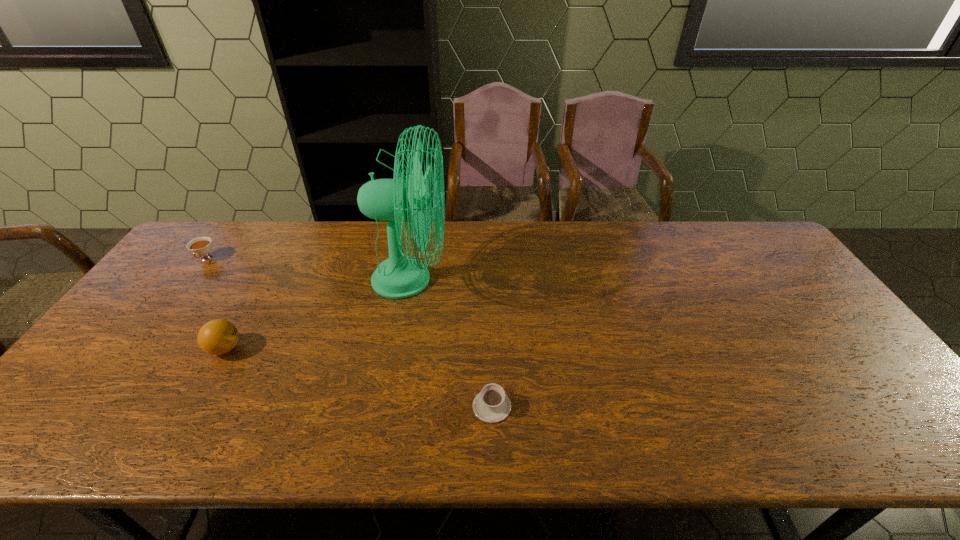
You are a GUI agent. You are given a task and a screenshot of the screen. Output one action in this format:
    pyautogui.click(x=<x>, y=<y>)
    Task: Click on the empty location between the tallest object and the ping-pong ball
    The width and height of the screenshot is (960, 540).
    Given the screenshot: What is the action you would take?
    click(x=318, y=314)

This screenshot has width=960, height=540. Find the location of `vacant region between the taller teacup and the nearest object`. vacant region between the taller teacup and the nearest object is located at coordinates (348, 333).

You are a GUI agent. You are given a task and a screenshot of the screen. Output one action in this format:
    pyautogui.click(x=<x>, y=<y>)
    Task: Click on the free space between the second object from right to left and the taller teacup
    This screenshot has width=960, height=540.
    Given the screenshot: What is the action you would take?
    pyautogui.click(x=308, y=269)

The height and width of the screenshot is (540, 960). What are the coordinates of `free space between the shortest object and the fan` in the screenshot? It's located at (451, 343).

This screenshot has width=960, height=540. What are the coordinates of `object that is the third nearest to the third tallest object` in the screenshot? It's located at (491, 405).

Choose which object is the third nearest neighbor to the farther teacup. Please provide its 2D coordinates. Your answer should be formatted as a tuple, i.e. [(x, y)], where the tuple contains the x and y coordinates of a point satisfying the conditions above.

[(491, 405)]

Identify the location of free space that satisfies the following two spatial constraints: 1. on the handle side of the right teacup; 2. on the side with brand of the third farthest object. (491, 349).

Find the location of a particular element. Image resolution: width=960 pixels, height=540 pixels. blank area in the image that satisfies the following two spatial constraints: 1. on the side with brand of the second tallest object; 2. on the handle side of the right teacup is located at coordinates (193, 406).

Find the location of `free space that satisfies the following two spatial constraints: 1. on the handle side of the shorter teacup; 2. on the side with brand of the ping-pong ball`. free space that satisfies the following two spatial constraints: 1. on the handle side of the shorter teacup; 2. on the side with brand of the ping-pong ball is located at coordinates (491, 349).

Find the location of a particular element. vacant space that satisfies the following two spatial constraints: 1. on the handle side of the shorter teacup; 2. in front of the third object from left to right to blow air is located at coordinates (489, 280).